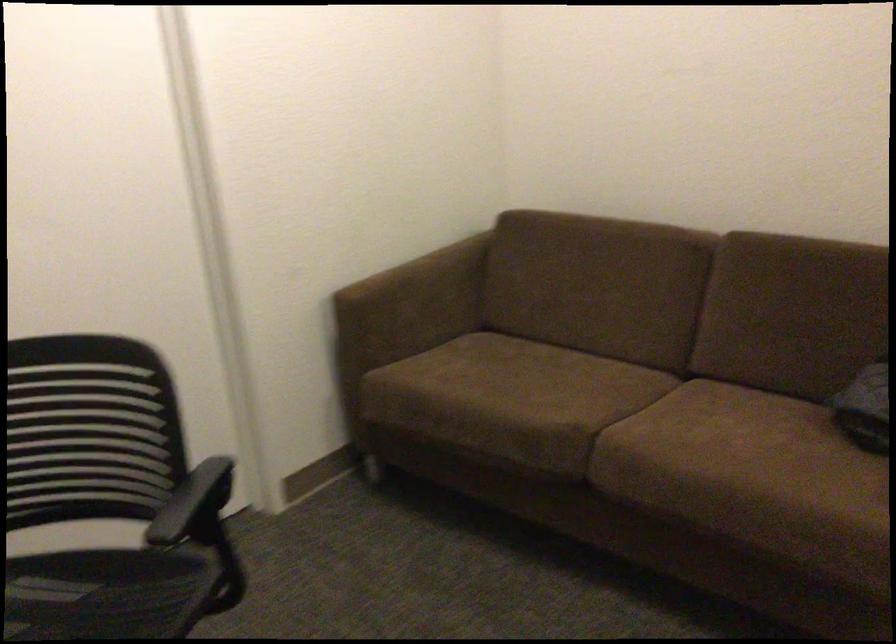
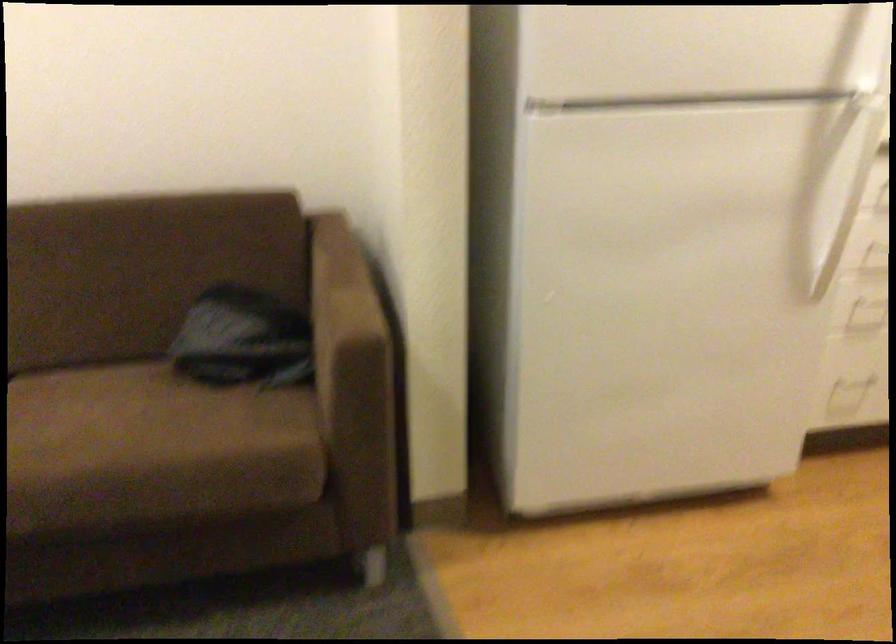
Question: The first image is from the beginning of the video and the second image is from the end. How did the camera likely rotate when shooting the video?

Choices:
 (A) Left
 (B) Right
 (C) Up
 (D) Down

Answer: (B)